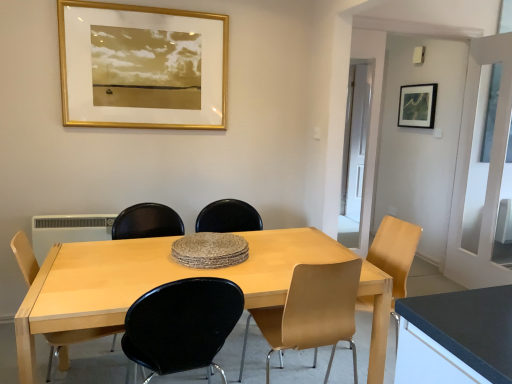
This screenshot has width=512, height=384. What are the coordinates of `vacant space situated above light wood table at center (from a real-world perspective)` in the screenshot? It's located at (192, 268).